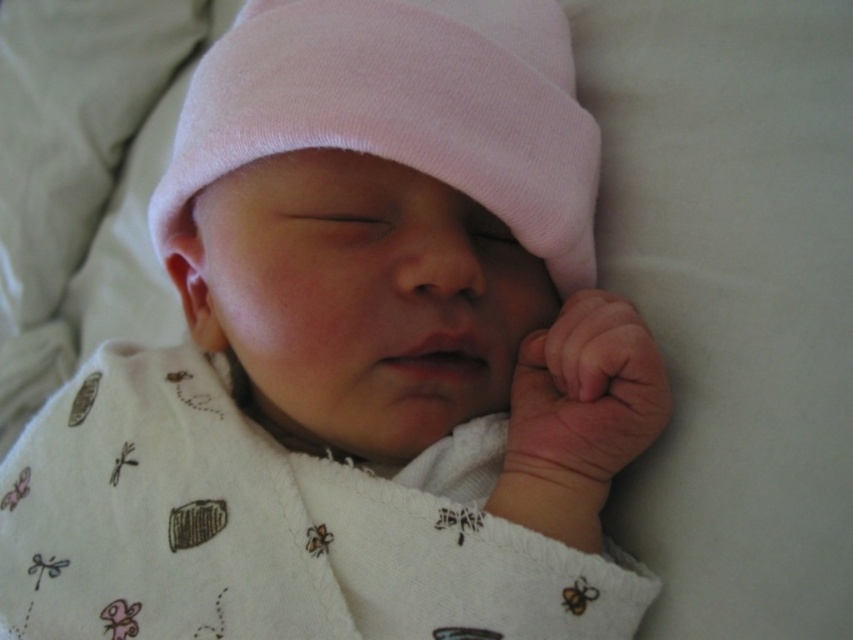
Question: Does pink cotton hat at center have a smaller size compared to smooth skin hand at lower right?

Choices:
 (A) no
 (B) yes

Answer: (A)

Question: Can you confirm if pink cotton hat at center is smaller than smooth skin hand at lower right?

Choices:
 (A) yes
 (B) no

Answer: (B)

Question: Which of the following is the closest to the observer?

Choices:
 (A) click(x=561, y=509)
 (B) click(x=213, y=42)

Answer: (A)

Question: Does pink cotton hat at center come behind smooth skin hand at lower right?

Choices:
 (A) no
 (B) yes

Answer: (B)

Question: Which of the following is the farthest from the observer?

Choices:
 (A) (641, 339)
 (B) (392, 138)

Answer: (B)